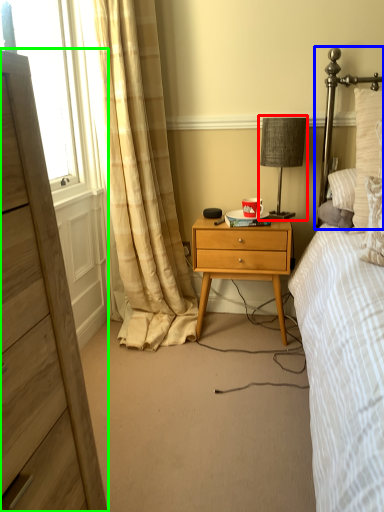
Question: Based on their relative distances, which object is farther from bedside lamp (highlighted by a red box)? Choose from headboard (highlighted by a blue box) and chest of drawers (highlighted by a green box).

Choices:
 (A) headboard
 (B) chest of drawers

Answer: (B)